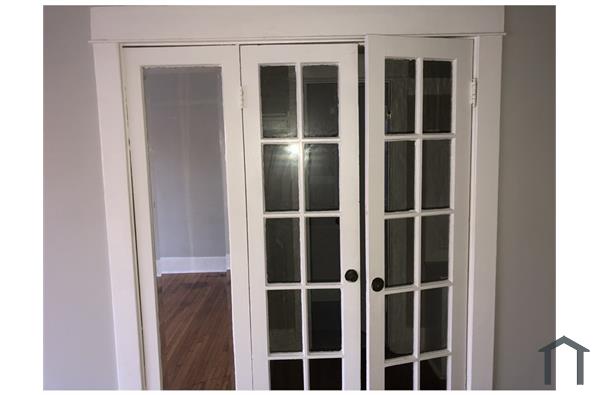
I want to click on frame, so point(215,55).